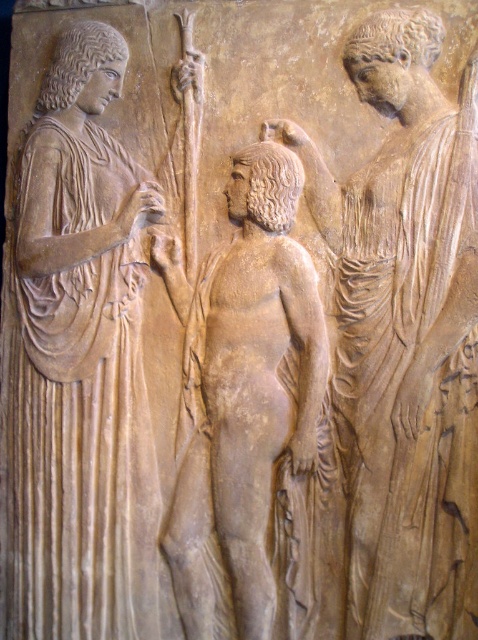
You are an art conservator examining the relief sculpture. You notice two points of interest marked as point 1 at coordinates point (473, 580) and point 2 at coordinates point (140, 468). Which point is closer to the viewer?

Point (473, 580) is closer to the camera than point (140, 468).

You are an art student analyzing the classical relief sculpture. You notice the matte stone figure at center and the matte beige robe at left. Which object is located to the right of the other?

The matte stone figure at center is positioned on the right side of matte beige robe at left, so the matte stone figure at center is to the right of the matte beige robe at left.

Based on the scene described, which object, the matte beige robe at left or the beige stone figure at center, has a greater width?

The matte beige robe at left might be wider than the beige stone figure at center according to the description.